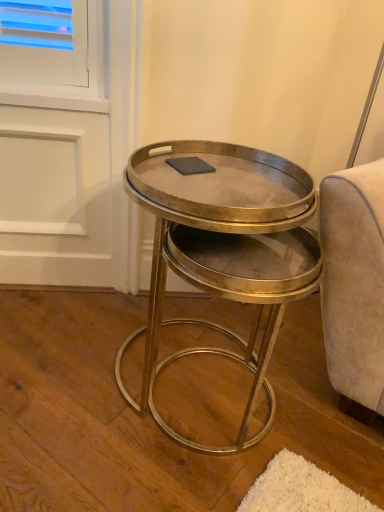
Question: Is shiny brass coffee table at center taller or shorter than matte gray fabric at center?

Choices:
 (A) short
 (B) tall

Answer: (B)

Question: Would you say shiny brass coffee table at center is to the left or to the right of matte gray fabric at center in the picture?

Choices:
 (A) left
 (B) right

Answer: (B)

Question: Considering their positions, is shiny brass coffee table at center located in front of or behind matte gray fabric at center?

Choices:
 (A) behind
 (B) front

Answer: (B)

Question: Based on their positions, is matte gray fabric at center located to the left or right of shiny brass coffee table at center?

Choices:
 (A) left
 (B) right

Answer: (A)

Question: Considering the positions of matte gray fabric at center and shiny brass coffee table at center in the image, is matte gray fabric at center taller or shorter than shiny brass coffee table at center?

Choices:
 (A) tall
 (B) short

Answer: (B)

Question: Is point (213, 168) positioned closer to the camera than point (266, 241)?

Choices:
 (A) closer
 (B) farther

Answer: (B)

Question: In terms of width, does matte gray fabric at center look wider or thinner when compared to shiny brass coffee table at center?

Choices:
 (A) wide
 (B) thin

Answer: (B)